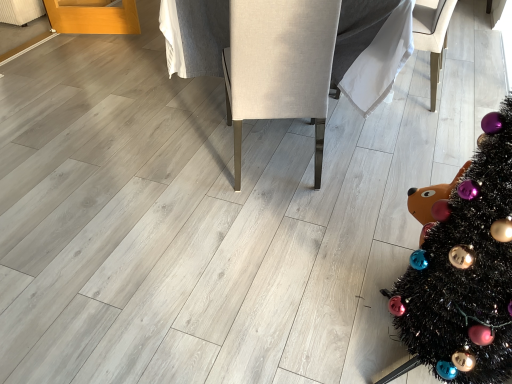
Describe the element at coordinates (280, 66) in the screenshot. Image resolution: width=512 pixels, height=384 pixels. I see `beige fabric armchair at center, which is the first armchair from left to right` at that location.

Where is `black tinsel christmas tree at lower right`? The width and height of the screenshot is (512, 384). black tinsel christmas tree at lower right is located at coordinates (464, 272).

Which is nearer, (x=267, y=30) or (x=490, y=300)?

Clearly, point (x=267, y=30) is more distant from the camera than point (x=490, y=300).

From a real-world perspective, is beige fabric armchair at center, which is the first armchair from left to right, physically below black tinsel christmas tree at lower right?

Yes.

Is the depth of beige fabric armchair at center, which is the first armchair from left to right, less than that of black tinsel christmas tree at lower right?

That is False.

Find the location of a particular element. This screenshot has width=512, height=384. armchair that is the 1st one below the black tinsel christmas tree at lower right (from a real-world perspective) is located at coordinates (280, 66).

The image size is (512, 384). What are the coordinates of `armchair that appears on the right of black tinsel christmas tree at lower right` in the screenshot? It's located at (432, 36).

Is white fabric armchair at center, placed as the 1th armchair when sorted from right to left, at the back of black tinsel christmas tree at lower right?

No, white fabric armchair at center, placed as the 1th armchair when sorted from right to left, is not at the back of black tinsel christmas tree at lower right.

Between black tinsel christmas tree at lower right and white fabric armchair at center, placed as the 1th armchair when sorted from right to left, which one has smaller width?

white fabric armchair at center, placed as the 1th armchair when sorted from right to left, is thinner.

In terms of height, does black tinsel christmas tree at lower right look taller or shorter compared to white fabric armchair at center, the second armchair in the left-to-right sequence?

Clearly, black tinsel christmas tree at lower right is taller compared to white fabric armchair at center, the second armchair in the left-to-right sequence.

Which object is wider, white fabric armchair at center, placed as the 1th armchair when sorted from right to left, or beige fabric armchair at center, the 2th armchair viewed from the right?

beige fabric armchair at center, the 2th armchair viewed from the right.

Between white fabric armchair at center, the second armchair in the left-to-right sequence, and beige fabric armchair at center, which is the first armchair from left to right, which one has smaller size?

With smaller size is white fabric armchair at center, the second armchair in the left-to-right sequence.

From a real-world perspective, which object rests below the other?

white fabric armchair at center, the second armchair in the left-to-right sequence.

Is there a large distance between white fabric armchair at center, the second armchair in the left-to-right sequence, and beige fabric armchair at center, which is the first armchair from left to right?

Indeed, white fabric armchair at center, the second armchair in the left-to-right sequence, is not near beige fabric armchair at center, which is the first armchair from left to right.

Are white fabric armchair at center, placed as the 1th armchair when sorted from right to left, and black tinsel christmas tree at lower right located far from each other?

Yes, white fabric armchair at center, placed as the 1th armchair when sorted from right to left, and black tinsel christmas tree at lower right are quite far apart.

How many degrees apart are the facing directions of white fabric armchair at center, the second armchair in the left-to-right sequence, and black tinsel christmas tree at lower right?

The facing directions of white fabric armchair at center, the second armchair in the left-to-right sequence, and black tinsel christmas tree at lower right are 1.05 degrees apart.

Considering the sizes of objects white fabric armchair at center, placed as the 1th armchair when sorted from right to left, and black tinsel christmas tree at lower right in the image provided, who is smaller, white fabric armchair at center, placed as the 1th armchair when sorted from right to left, or black tinsel christmas tree at lower right?

With smaller size is white fabric armchair at center, placed as the 1th armchair when sorted from right to left.

Which is more to the left, white fabric armchair at center, placed as the 1th armchair when sorted from right to left, or black tinsel christmas tree at lower right?

From the viewer's perspective, black tinsel christmas tree at lower right appears more on the left side.

How much distance is there between beige fabric armchair at center, the 2th armchair viewed from the right, and white fabric armchair at center, placed as the 1th armchair when sorted from right to left?

beige fabric armchair at center, the 2th armchair viewed from the right, and white fabric armchair at center, placed as the 1th armchair when sorted from right to left, are 3.63 feet apart from each other.

Considering the sizes of objects beige fabric armchair at center, which is the first armchair from left to right, and white fabric armchair at center, placed as the 1th armchair when sorted from right to left, in the image provided, who is wider, beige fabric armchair at center, which is the first armchair from left to right, or white fabric armchair at center, placed as the 1th armchair when sorted from right to left,?

beige fabric armchair at center, which is the first armchair from left to right.

Does beige fabric armchair at center, the 2th armchair viewed from the right, turn towards white fabric armchair at center, placed as the 1th armchair when sorted from right to left?

No, beige fabric armchair at center, the 2th armchair viewed from the right, is not aimed at white fabric armchair at center, placed as the 1th armchair when sorted from right to left.

Is beige fabric armchair at center, which is the first armchair from left to right, not near white fabric armchair at center, placed as the 1th armchair when sorted from right to left?

Yes, beige fabric armchair at center, which is the first armchair from left to right, is far from white fabric armchair at center, placed as the 1th armchair when sorted from right to left.

From the image's perspective, is black tinsel christmas tree at lower right above beige fabric armchair at center, which is the first armchair from left to right?

Actually, black tinsel christmas tree at lower right appears below beige fabric armchair at center, which is the first armchair from left to right, in the image.

Is black tinsel christmas tree at lower right looking in the opposite direction of beige fabric armchair at center, which is the first armchair from left to right?

No, black tinsel christmas tree at lower right's orientation is not away from beige fabric armchair at center, which is the first armchair from left to right.

Does black tinsel christmas tree at lower right have a smaller size compared to beige fabric armchair at center, which is the first armchair from left to right?

Correct, black tinsel christmas tree at lower right occupies less space than beige fabric armchair at center, which is the first armchair from left to right.

There is a black tinsel christmas tree at lower right. Where is `the 1st armchair above it (from the image's perspective)`? The height and width of the screenshot is (384, 512). the 1st armchair above it (from the image's perspective) is located at coordinates (280, 66).

Locate an element on the screen. armchair on the right of black tinsel christmas tree at lower right is located at coordinates (432, 36).

From the image, which object appears to be nearer to black tinsel christmas tree at lower right, white fabric armchair at center, the second armchair in the left-to-right sequence, or beige fabric armchair at center, the 2th armchair viewed from the right?

The object closer to black tinsel christmas tree at lower right is beige fabric armchair at center, the 2th armchair viewed from the right.

Estimate the real-world distances between objects in this image. Which object is further from beige fabric armchair at center, the 2th armchair viewed from the right, white fabric armchair at center, the second armchair in the left-to-right sequence, or black tinsel christmas tree at lower right?

white fabric armchair at center, the second armchair in the left-to-right sequence, is positioned further to the anchor beige fabric armchair at center, the 2th armchair viewed from the right.

From the picture: When comparing their distances from white fabric armchair at center, placed as the 1th armchair when sorted from right to left, does beige fabric armchair at center, the 2th armchair viewed from the right, or black tinsel christmas tree at lower right seem further?

The object further to white fabric armchair at center, placed as the 1th armchair when sorted from right to left, is black tinsel christmas tree at lower right.

When comparing their distances from black tinsel christmas tree at lower right, does beige fabric armchair at center, the 2th armchair viewed from the right, or white fabric armchair at center, the second armchair in the left-to-right sequence, seem closer?

Among the two, beige fabric armchair at center, the 2th armchair viewed from the right, is located nearer to black tinsel christmas tree at lower right.

Looking at the image, which one is located further to beige fabric armchair at center, the 2th armchair viewed from the right, black tinsel christmas tree at lower right or white fabric armchair at center, placed as the 1th armchair when sorted from right to left?

white fabric armchair at center, placed as the 1th armchair when sorted from right to left, is positioned further to the anchor beige fabric armchair at center, the 2th armchair viewed from the right.

From the image, which object appears to be farther from white fabric armchair at center, the second armchair in the left-to-right sequence, black tinsel christmas tree at lower right or beige fabric armchair at center, which is the first armchair from left to right?

black tinsel christmas tree at lower right is positioned further to the anchor white fabric armchair at center, the second armchair in the left-to-right sequence.

The width and height of the screenshot is (512, 384). I want to click on armchair positioned between black tinsel christmas tree at lower right and white fabric armchair at center, the second armchair in the left-to-right sequence, from near to far, so click(x=280, y=66).